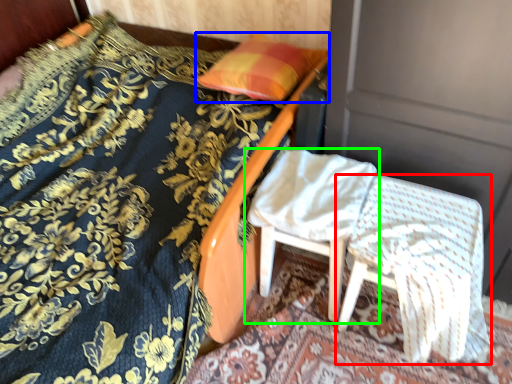
Question: Which is nearer to the chair (highlighted by a red box)? pillow (highlighted by a blue box) or chair (highlighted by a green box).

Choices:
 (A) pillow
 (B) chair

Answer: (B)